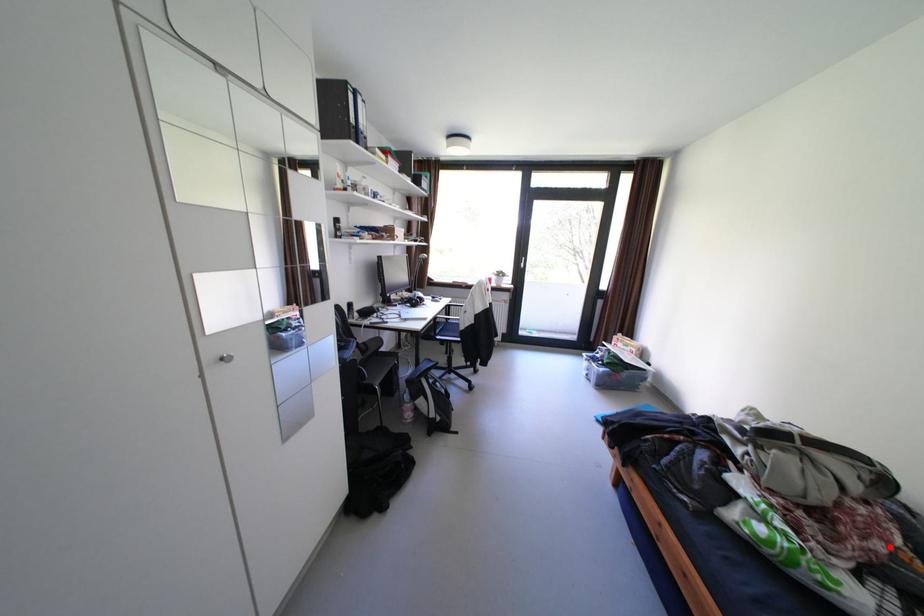
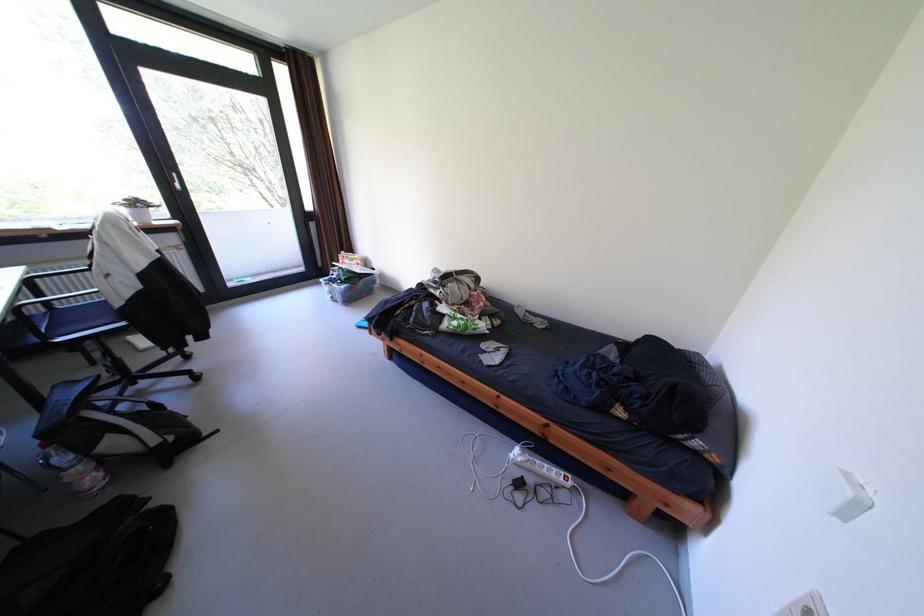
Question: I am providing you with two images of the same scene from different viewpoints. Given a red point in image1, look at the same physical point in image2. Is it:

Choices:
 (A) Closer to the viewpoint
 (B) Farther from the viewpoint

Answer: (B)